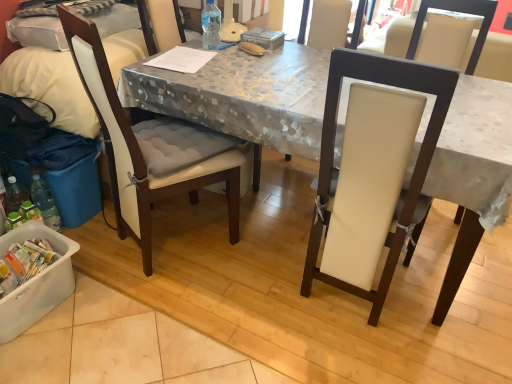
Locate an element on the screen. The width and height of the screenshot is (512, 384). vacant space in front of white leather chair at center, acting as the first chair starting from the right is located at coordinates (355, 354).